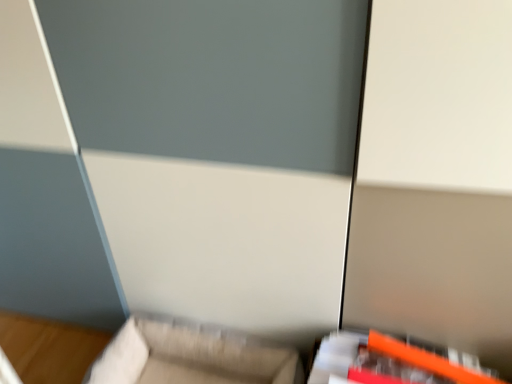
Question: Is orange plastic ruler at lower right, which ranks as the first furniture in right-to-left order, beside beige fabric couch at lower center, placed as the first furniture when sorted from left to right?

Choices:
 (A) yes
 (B) no

Answer: (B)

Question: Is there a large distance between orange plastic ruler at lower right, acting as the second furniture starting from the left, and beige fabric couch at lower center, the 2th furniture viewed from the right?

Choices:
 (A) yes
 (B) no

Answer: (B)

Question: From a real-world perspective, is orange plastic ruler at lower right, acting as the second furniture starting from the left, beneath beige fabric couch at lower center, the 2th furniture viewed from the right?

Choices:
 (A) no
 (B) yes

Answer: (A)

Question: From the image's perspective, would you say orange plastic ruler at lower right, acting as the second furniture starting from the left, is positioned over beige fabric couch at lower center, the 2th furniture viewed from the right?

Choices:
 (A) no
 (B) yes

Answer: (B)

Question: From a real-world perspective, is orange plastic ruler at lower right, acting as the second furniture starting from the left, positioned over beige fabric couch at lower center, placed as the first furniture when sorted from left to right, based on gravity?

Choices:
 (A) yes
 (B) no

Answer: (A)

Question: Is orange plastic ruler at lower right, which ranks as the first furniture in right-to-left order, further to camera compared to beige fabric couch at lower center, placed as the first furniture when sorted from left to right?

Choices:
 (A) no
 (B) yes

Answer: (A)

Question: From a real-world perspective, is beige fabric couch at lower center, the 2th furniture viewed from the right, beneath orange plastic ruler at lower right, acting as the second furniture starting from the left?

Choices:
 (A) no
 (B) yes

Answer: (B)

Question: Does beige fabric couch at lower center, placed as the first furniture when sorted from left to right, have a greater height compared to orange plastic ruler at lower right, which ranks as the first furniture in right-to-left order?

Choices:
 (A) no
 (B) yes

Answer: (B)

Question: Would you say beige fabric couch at lower center, the 2th furniture viewed from the right, is outside orange plastic ruler at lower right, acting as the second furniture starting from the left?

Choices:
 (A) no
 (B) yes

Answer: (B)

Question: Is beige fabric couch at lower center, placed as the first furniture when sorted from left to right, shorter than orange plastic ruler at lower right, which ranks as the first furniture in right-to-left order?

Choices:
 (A) no
 (B) yes

Answer: (A)

Question: Considering the relative sizes of beige fabric couch at lower center, the 2th furniture viewed from the right, and orange plastic ruler at lower right, acting as the second furniture starting from the left, in the image provided, is beige fabric couch at lower center, the 2th furniture viewed from the right, wider than orange plastic ruler at lower right, acting as the second furniture starting from the left,?

Choices:
 (A) yes
 (B) no

Answer: (A)

Question: Is beige fabric couch at lower center, placed as the first furniture when sorted from left to right, further to the viewer compared to orange plastic ruler at lower right, acting as the second furniture starting from the left?

Choices:
 (A) no
 (B) yes

Answer: (B)

Question: From a real-world perspective, is orange plastic ruler at lower right, acting as the second furniture starting from the left, positioned above or below beige fabric couch at lower center, the 2th furniture viewed from the right?

Choices:
 (A) below
 (B) above

Answer: (B)